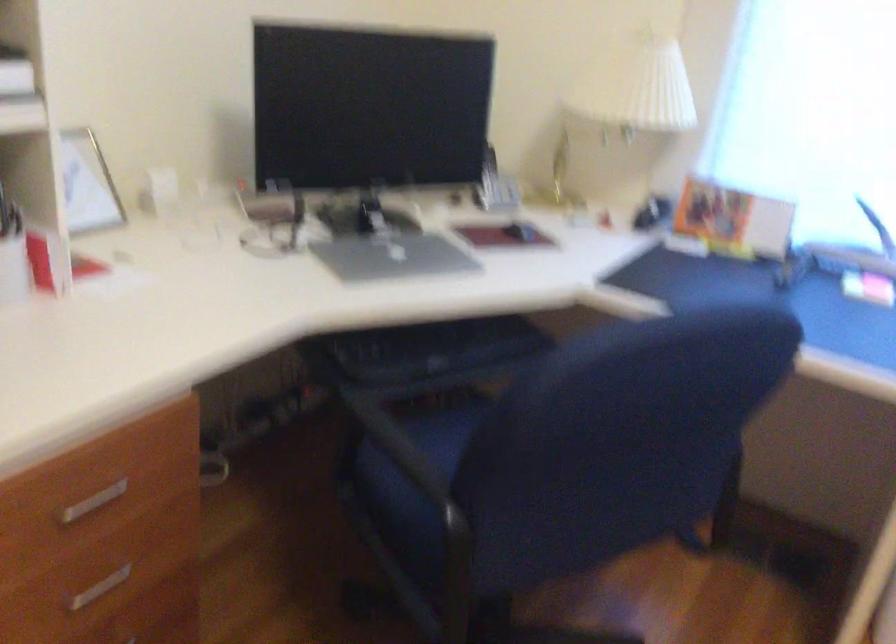
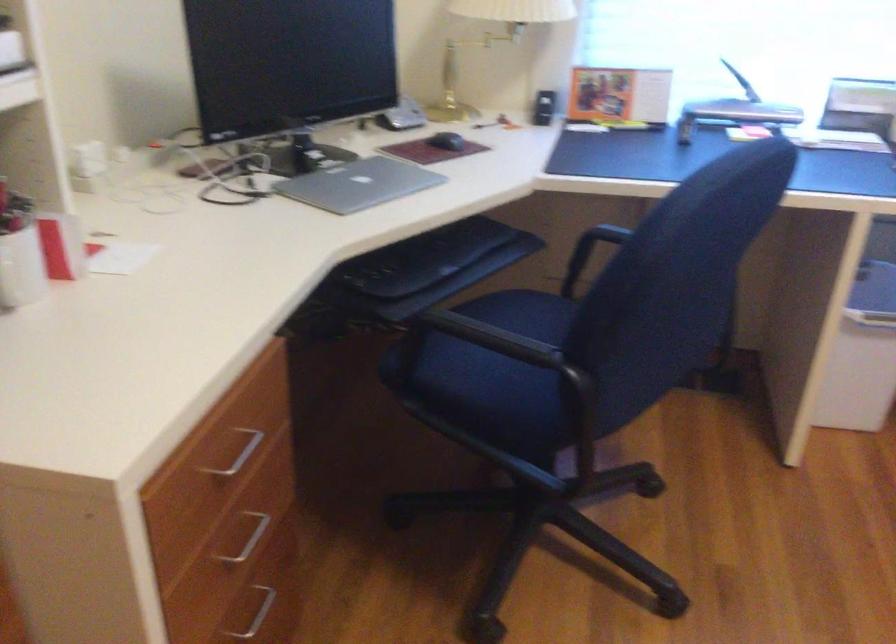
The point at (388, 438) is marked in the first image. Where is the corresponding point in the second image?

(478, 339)